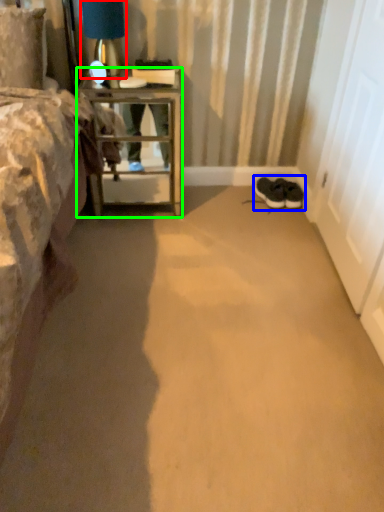
Question: Considering the real-world distances, which object is closest to table lamp (highlighted by a red box)? footwear (highlighted by a blue box) or nightstand (highlighted by a green box).

Choices:
 (A) footwear
 (B) nightstand

Answer: (B)